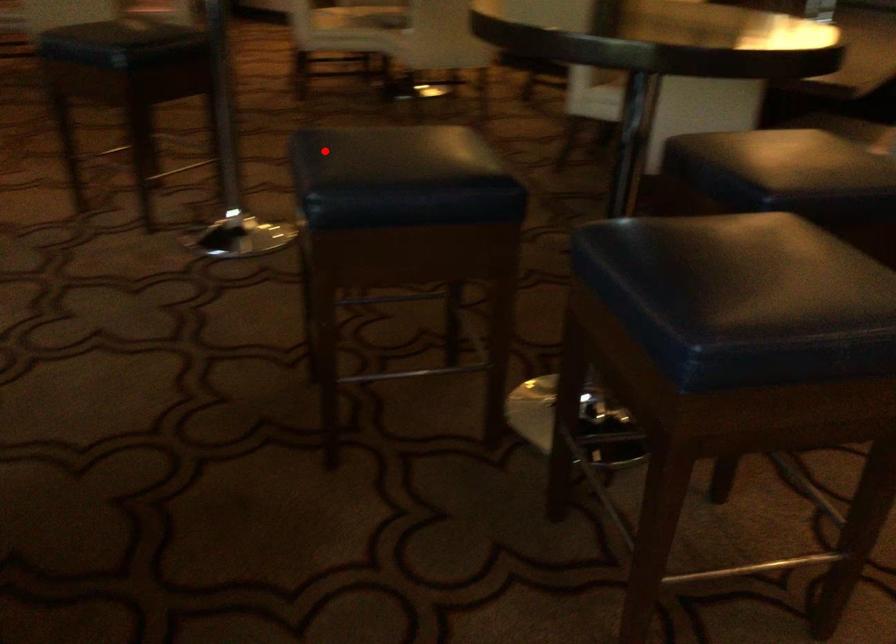
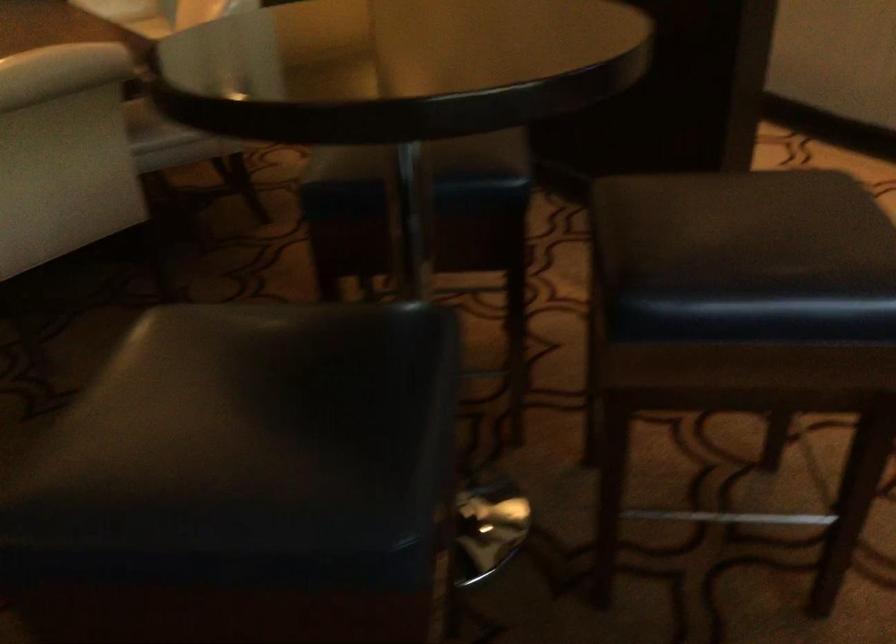
Where in the second image is the point corresponding to the highlighted location from the first image?

(247, 436)